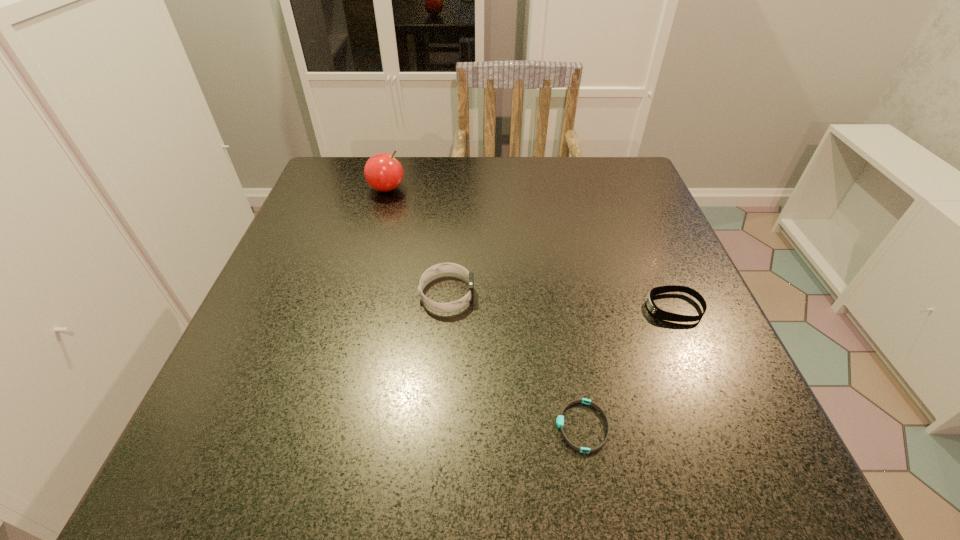
At what (x,y) coordinates should I click in order to perform the action: click on vacant space located 0.140m on the display of the rightmost object. Please return your answer as a coordinate pair (x, y). Image resolution: width=960 pixels, height=540 pixels. Looking at the image, I should click on (569, 308).

Image resolution: width=960 pixels, height=540 pixels. In order to click on free space located 0.150m on the display of the rightmost object in this screenshot , I will do `click(564, 308)`.

Identify the location of vacant space located 0.180m on the display of the rightmost object. tap(547, 308).

This screenshot has height=540, width=960. What are the coordinates of `vacant position located 0.130m on the buckle of the second wristband from left to right` in the screenshot? It's located at (466, 426).

Identify the location of vacant space located on the buckle of the second wristband from left to right. (390, 426).

The image size is (960, 540). Identify the location of vacant space located on the buckle of the second wristband from left to right. (341, 426).

The height and width of the screenshot is (540, 960). I want to click on object situated at the far edge, so click(x=384, y=173).

The width and height of the screenshot is (960, 540). I want to click on object located at the near edge, so click(x=560, y=419).

The width and height of the screenshot is (960, 540). I want to click on object situated at the left edge, so click(x=384, y=173).

Find the location of a particular element. The width and height of the screenshot is (960, 540). object located at the right edge is located at coordinates (657, 312).